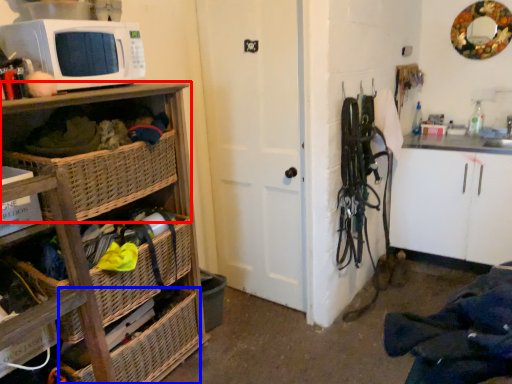
Question: Among these objects, which one is farthest to the camera, shelf (highlighted by a red box) or basket (highlighted by a blue box)?

Choices:
 (A) shelf
 (B) basket

Answer: (B)